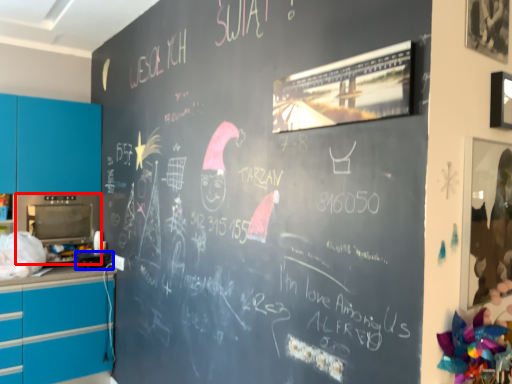
Question: Which object appears farthest to the camera in this image, appliance (highlighted by a red box) or appliance (highlighted by a blue box)?

Choices:
 (A) appliance
 (B) appliance

Answer: (A)